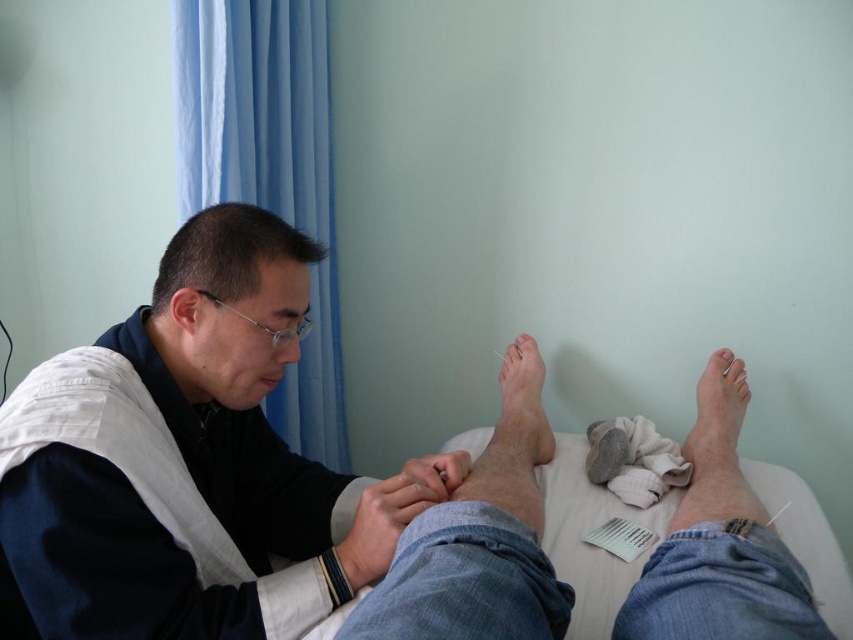
Question: Is pale skin foot at lower right thinner than skinny flesh-toned foot at center?

Choices:
 (A) yes
 (B) no

Answer: (B)

Question: In this image, where is matte black shirt at center located relative to gray fabric sock at lower right?

Choices:
 (A) right
 (B) left

Answer: (B)

Question: Based on their relative distances, which object is farther from the gray fabric sock at lower right?

Choices:
 (A) pale skin foot at lower right
 (B) white matte toe at center
 (C) skinny flesh-toned foot at center
 (D) matte black shirt at center

Answer: (D)

Question: Which of the following is the farthest from the observer?

Choices:
 (A) (412, 634)
 (B) (730, 356)
 (C) (607, 465)

Answer: (B)

Question: Based on their relative distances, which object is nearer to the pale skin foot at lower right?

Choices:
 (A) gray fabric sock at lower right
 (B) white matte toe at center

Answer: (A)

Question: Is blue denim shorts at lower center to the right of skinny flesh-toned foot at center from the viewer's perspective?

Choices:
 (A) yes
 (B) no

Answer: (A)